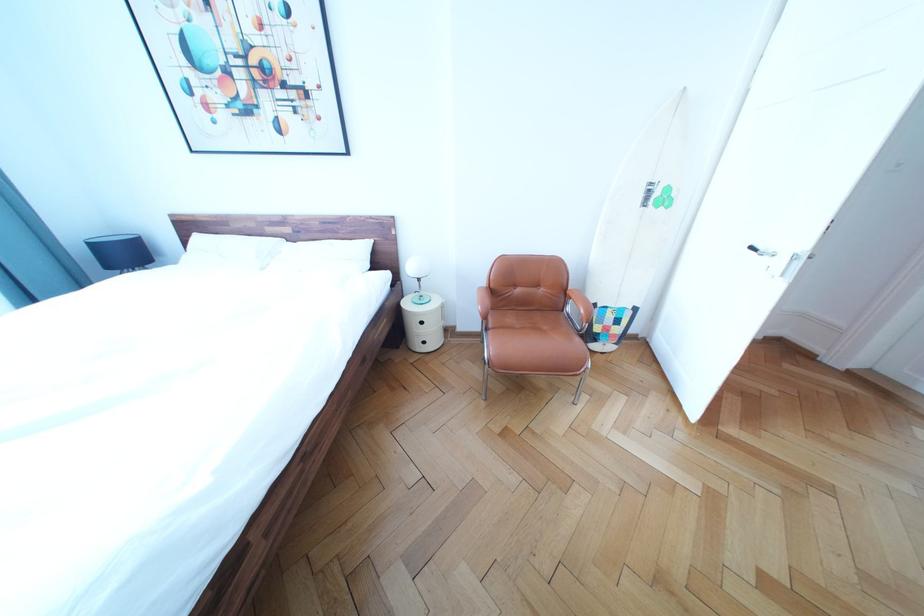
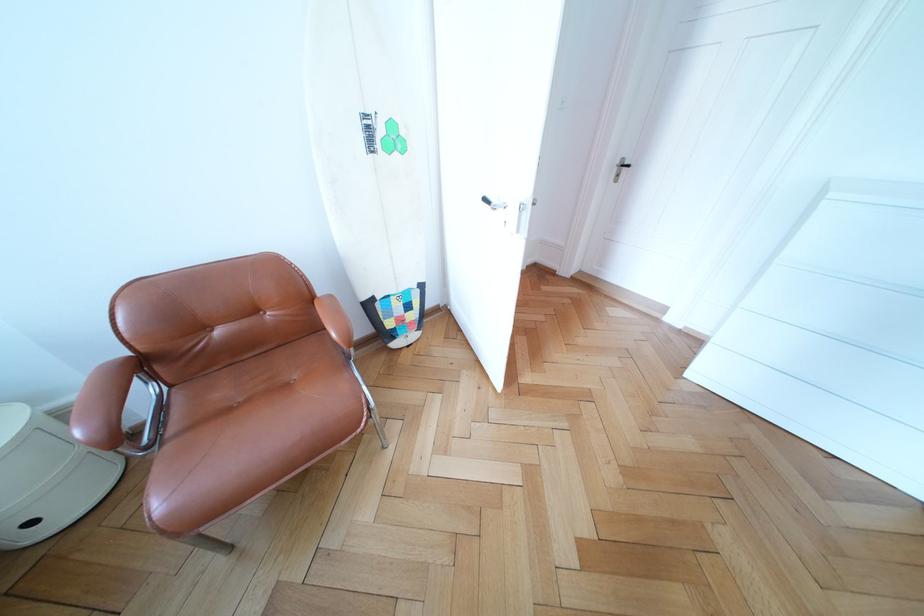
Locate, in the second image, the point that corresponds to [610,312] in the first image.

(390, 304)